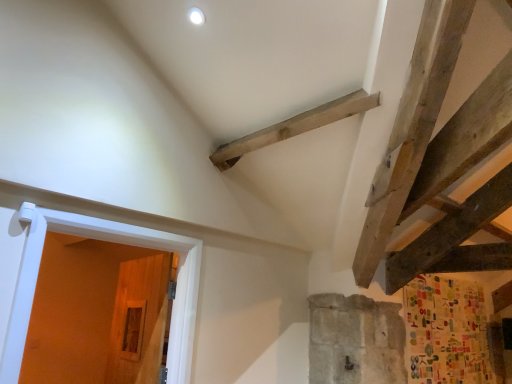
Question: From the image's perspective, would you say wooden door at lower left, positioned as the 2th door in front-to-back order, is positioned over white painted wood door at left, the first door from the front?

Choices:
 (A) yes
 (B) no

Answer: (B)

Question: From the image's perspective, would you say wooden door at lower left, which is counted as the first door, starting from the back, is shown under white painted wood door at left, which is the second door from back to front?

Choices:
 (A) yes
 (B) no

Answer: (A)

Question: From a real-world perspective, is wooden door at lower left, positioned as the 2th door in front-to-back order, on white painted wood door at left, the first door from the front?

Choices:
 (A) yes
 (B) no

Answer: (B)

Question: Could white painted wood door at left, which is the second door from back to front, be considered to be inside wooden door at lower left, positioned as the 2th door in front-to-back order?

Choices:
 (A) no
 (B) yes

Answer: (A)

Question: Considering the relative positions of wooden door at lower left, positioned as the 2th door in front-to-back order, and white painted wood door at left, the first door from the front, in the image provided, is wooden door at lower left, positioned as the 2th door in front-to-back order, to the right of white painted wood door at left, the first door from the front, from the viewer's perspective?

Choices:
 (A) yes
 (B) no

Answer: (B)

Question: Is wooden door at lower left, positioned as the 2th door in front-to-back order, wider than white painted wood door at left, the first door from the front?

Choices:
 (A) no
 (B) yes

Answer: (B)

Question: From a real-world perspective, is white painted wood door at left, the first door from the front, on top of wooden door at lower left, which is counted as the first door, starting from the back?

Choices:
 (A) no
 (B) yes

Answer: (B)

Question: Does white painted wood door at left, the first door from the front, have a lesser height compared to wooden door at lower left, positioned as the 2th door in front-to-back order?

Choices:
 (A) no
 (B) yes

Answer: (B)

Question: Is white painted wood door at left, which is the second door from back to front, outside wooden door at lower left, positioned as the 2th door in front-to-back order?

Choices:
 (A) no
 (B) yes

Answer: (B)

Question: Considering the relative positions of white painted wood door at left, the first door from the front, and wooden door at lower left, which is counted as the first door, starting from the back, in the image provided, is white painted wood door at left, the first door from the front, to the left of wooden door at lower left, which is counted as the first door, starting from the back, from the viewer's perspective?

Choices:
 (A) yes
 (B) no

Answer: (B)

Question: Does white painted wood door at left, which is the second door from back to front, have a larger size compared to wooden door at lower left, which is counted as the first door, starting from the back?

Choices:
 (A) yes
 (B) no

Answer: (A)

Question: Can you confirm if white painted wood door at left, the first door from the front, is taller than wooden door at lower left, which is counted as the first door, starting from the back?

Choices:
 (A) yes
 (B) no

Answer: (B)

Question: From a real-world perspective, is white painted wood door at left, which is the second door from back to front, positioned above or below wooden door at lower left, which is counted as the first door, starting from the back?

Choices:
 (A) above
 (B) below

Answer: (A)